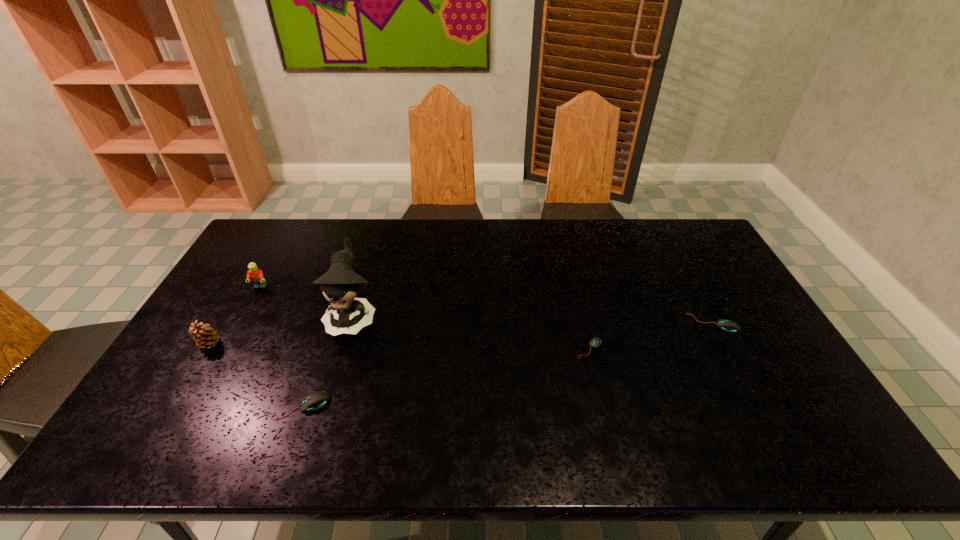
Locate an element on the screen. vacant space that satisfies the following two spatial constraints: 1. on the back side of the nearest mouse; 2. on the left side of the rightmost mouse is located at coordinates (325, 323).

Find the location of a particular element. The height and width of the screenshot is (540, 960). free spot that satisfies the following two spatial constraints: 1. on the back side of the rightmost object; 2. on the left side of the pinecone is located at coordinates (222, 323).